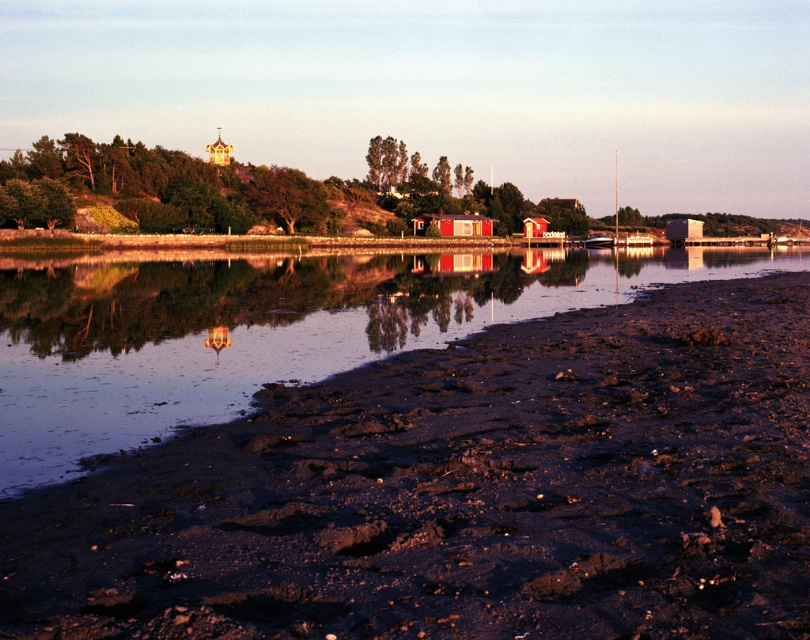
Can you confirm if red wooden cabin at center is positioned to the left of red wooden hut at center?

Indeed, red wooden cabin at center is positioned on the left side of red wooden hut at center.

Which is in front, point (475, 220) or point (536, 227)?

Point (475, 220)

Is point (476, 230) less distant than point (529, 234)?

Yes, it is in front of point (529, 234).

You are a GUI agent. You are given a task and a screenshot of the screen. Output one action in this format:
    pyautogui.click(x=<x>, y=<y>)
    Task: Click on the red wooden cabin at center
    This screenshot has height=640, width=810.
    Given the screenshot: What is the action you would take?
    pyautogui.click(x=454, y=225)

Who is positioned more to the right, damp brown mud at lower left or red wooden cabin at center?

From the viewer's perspective, red wooden cabin at center appears more on the right side.

Which is below, damp brown mud at lower left or red wooden cabin at center?

Positioned lower is damp brown mud at lower left.

Is point (514, 492) closer to camera compared to point (452, 220)?

Yes, it is.

At what (x,y) coordinates should I click in order to perform the action: click on damp brown mud at lower left. Please return your answer as a coordinate pair (x, y). Looking at the image, I should click on (463, 492).

Between damp brown mud at lower left and red wooden hut at center, which one has less height?

damp brown mud at lower left

Is damp brown mud at lower left positioned in front of red wooden hut at center?

Yes, it is in front of red wooden hut at center.

Between point (397, 634) and point (546, 220), which one is positioned behind?

Point (546, 220)

The width and height of the screenshot is (810, 640). What are the coordinates of `damp brown mud at lower left` in the screenshot? It's located at (463, 492).